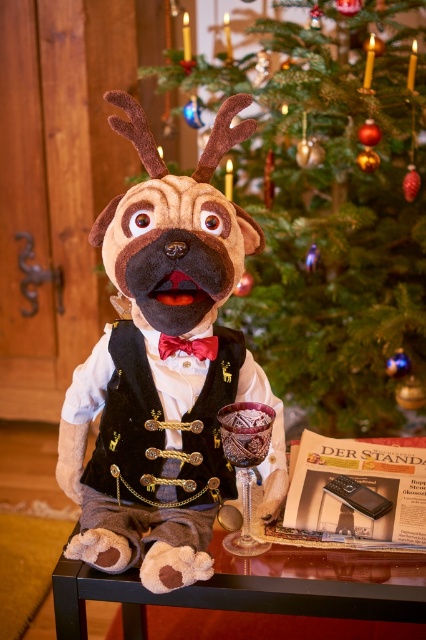
How distant is green textured christmas tree at center from red satin bow tie at center?

green textured christmas tree at center and red satin bow tie at center are 37.45 inches apart from each other.

Is green textured christmas tree at center thinner than red satin bow tie at center?

Incorrect, green textured christmas tree at center's width is not less than red satin bow tie at center's.

Where is `green textured christmas tree at center`? This screenshot has height=640, width=426. green textured christmas tree at center is located at coordinates (331, 205).

The height and width of the screenshot is (640, 426). Identify the location of green textured christmas tree at center. (331, 205).

Who is shorter, green textured christmas tree at center or shiny dark wood table at lower center?

shiny dark wood table at lower center

Is green textured christmas tree at center wider than shiny dark wood table at lower center?

Correct, the width of green textured christmas tree at center exceeds that of shiny dark wood table at lower center.

You are a GUI agent. You are given a task and a screenshot of the screen. Output one action in this format:
    pyautogui.click(x=<x>, y=<y>)
    Task: Click on the green textured christmas tree at center
    
    Given the screenshot: What is the action you would take?
    pyautogui.click(x=331, y=205)

You are a GUI agent. You are given a task and a screenshot of the screen. Output one action in this format:
    pyautogui.click(x=<x>, y=<y>)
    Task: Click on the green textured christmas tree at center
    The image size is (426, 640).
    Given the screenshot: What is the action you would take?
    pyautogui.click(x=331, y=205)

Who is taller, green textured christmas tree at center or translucent purple glass goblet at lower center?

With more height is green textured christmas tree at center.

Measure the distance between green textured christmas tree at center and camera.

green textured christmas tree at center is 1.38 meters from camera.

Who is more distant from viewer, (307, 180) or (267, 451)?

Positioned behind is point (307, 180).

This screenshot has width=426, height=640. I want to click on green textured christmas tree at center, so tap(331, 205).